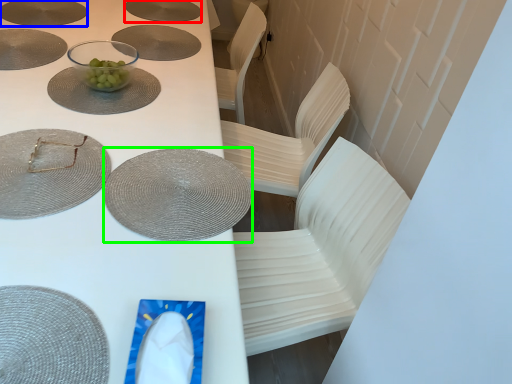
Question: Estimate the real-world distances between objects in this image. Which object is closer to platter (highlighted by a red box), platter (highlighted by a blue box) or tableware (highlighted by a green box)?

Choices:
 (A) platter
 (B) tableware

Answer: (A)